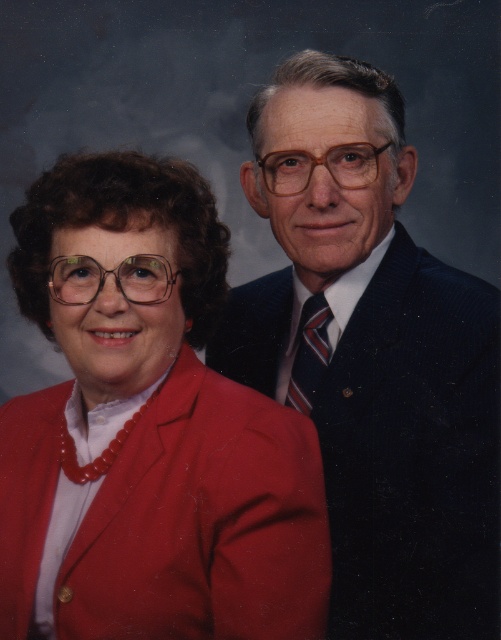
Question: Among these points, which one is nearest to the camera?

Choices:
 (A) (291, 388)
 (B) (344, 512)
 (C) (10, 257)

Answer: (C)

Question: Can you confirm if dark blue suit at center is positioned to the left of striped fabric tie at center-right?

Choices:
 (A) no
 (B) yes

Answer: (A)

Question: From the image, what is the correct spatial relationship of dark blue suit at center in relation to striped fabric tie at center-right?

Choices:
 (A) above
 (B) below

Answer: (B)

Question: Which point is closer to the camera taking this photo?

Choices:
 (A) (257, 200)
 (B) (303, 403)
 (C) (73, 296)

Answer: (C)

Question: In this image, where is matte red blazer at left located relative to striped fabric tie at center-right?

Choices:
 (A) left
 (B) right

Answer: (A)

Question: Which object is positioned farthest from the striped fabric tie at center-right?

Choices:
 (A) matte red blazer at left
 (B) dark blue suit at center

Answer: (A)